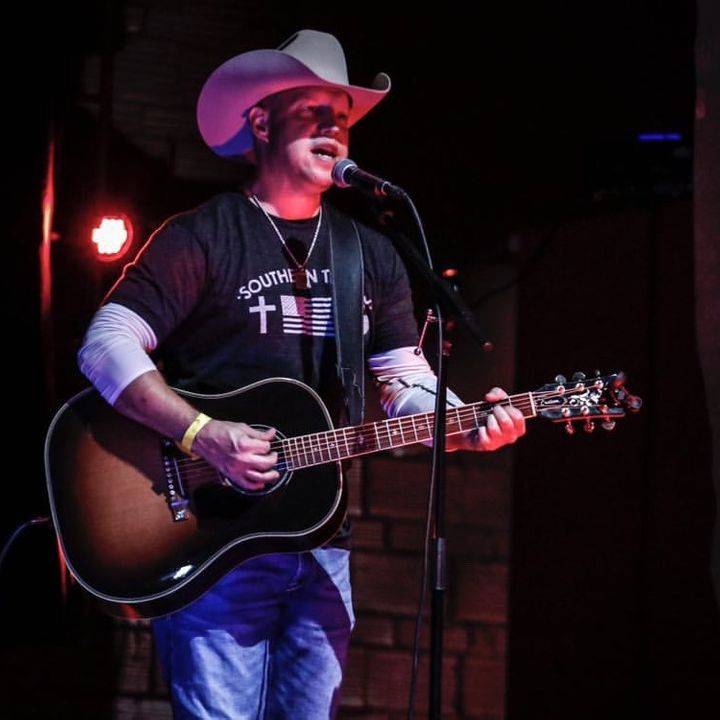
The height and width of the screenshot is (720, 720). I want to click on lights, so click(117, 243).